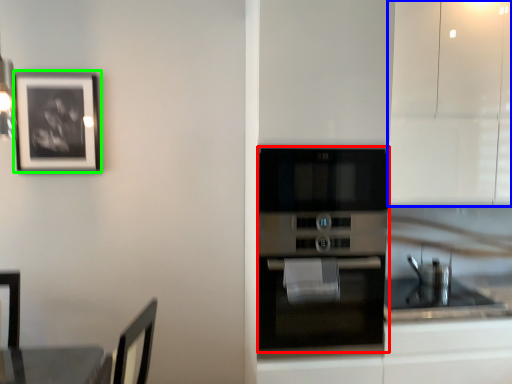
Question: Which is nearer to the oven (highlighted by a red box)? cabinetry (highlighted by a blue box) or picture frame (highlighted by a green box).

Choices:
 (A) cabinetry
 (B) picture frame

Answer: (A)